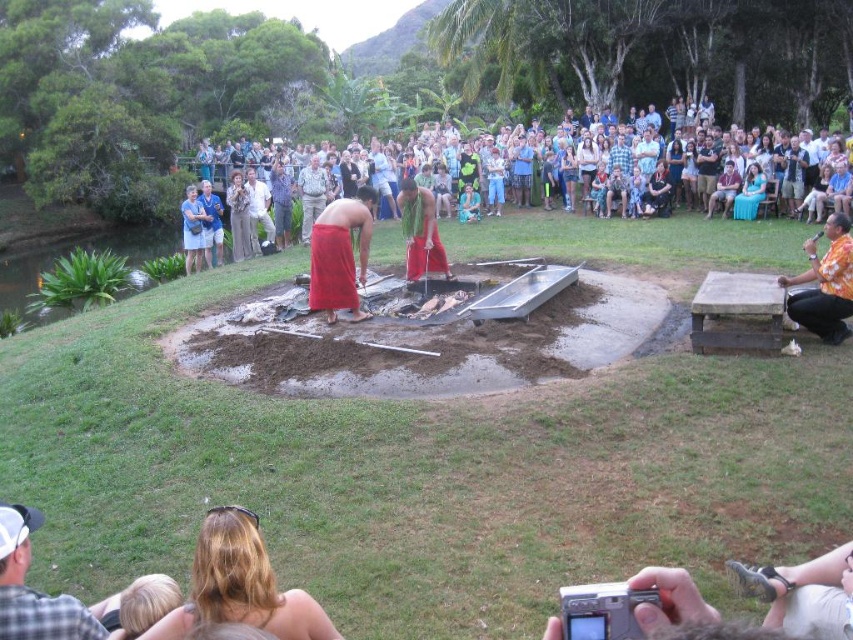
Question: Can you confirm if matte blue shirt at center is thinner than light blue fabric at center?

Choices:
 (A) yes
 (B) no

Answer: (A)

Question: Does plaid shirt at lower left have a greater width compared to camouflage shirt at center?

Choices:
 (A) yes
 (B) no

Answer: (B)

Question: Which object appears farthest from the camera in this image?

Choices:
 (A) light blue fabric at upper center
 (B) orange printed shirt at right
 (C) light blue shirt at center

Answer: (C)

Question: Which object is the closest to the camouflage shirt at center?

Choices:
 (A) green fabric shirt at upper center
 (B) red woven cloth at center
 (C) light blue shirt at center

Answer: (C)

Question: Can you confirm if brown clay pit at center is positioned to the left of camouflage shirt at center?

Choices:
 (A) no
 (B) yes

Answer: (A)

Question: Estimate the real-world distances between objects in this image. Which object is farther from the matte blue shirt at center?

Choices:
 (A) matte white shirt at upper center
 (B) brown clay pit at center
 (C) matte blue dress at upper left

Answer: (B)